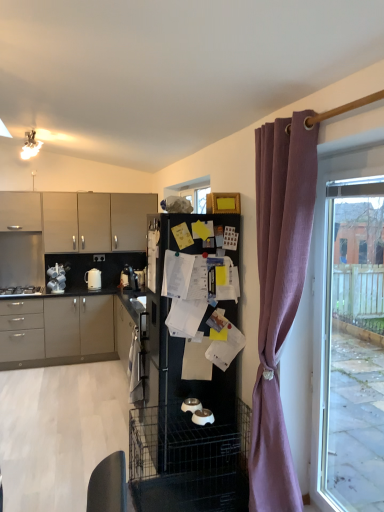
Question: Is white glossy kettle at left, positioned as the first appliance in top-to-bottom order, next to clear glass window at right and touching it?

Choices:
 (A) no
 (B) yes

Answer: (A)

Question: Can you confirm if white glossy kettle at left, arranged as the 2th appliance when viewed from the back, is thinner than clear glass window at right?

Choices:
 (A) no
 (B) yes

Answer: (A)

Question: Is white glossy kettle at left, positioned as the first appliance in top-to-bottom order, not close to clear glass window at right?

Choices:
 (A) no
 (B) yes

Answer: (B)

Question: Would you say clear glass window at right is part of white glossy kettle at left, the 3th appliance when ordered from front to back,'s contents?

Choices:
 (A) no
 (B) yes

Answer: (A)

Question: Is white glossy kettle at left, the 4th appliance when ordered from right to left, at the right side of clear glass window at right?

Choices:
 (A) yes
 (B) no

Answer: (B)

Question: From the image's perspective, is mauve fabric curtain at right located above or below white glossy kettle at left, acting as the first appliance starting from the left?

Choices:
 (A) above
 (B) below

Answer: (B)

Question: Considering the relative positions of mauve fabric curtain at right and white glossy kettle at left, the 4th appliance from the bottom, in the image provided, is mauve fabric curtain at right to the left or to the right of white glossy kettle at left, the 4th appliance from the bottom,?

Choices:
 (A) left
 (B) right

Answer: (B)

Question: In the image, is mauve fabric curtain at right positioned in front of or behind white glossy kettle at left, the 4th appliance when ordered from right to left?

Choices:
 (A) behind
 (B) front

Answer: (B)

Question: Is mauve fabric curtain at right wider or thinner than white glossy kettle at left, acting as the first appliance starting from the left?

Choices:
 (A) wide
 (B) thin

Answer: (A)

Question: Is point (193, 397) closer or farther from the camera than point (198, 417)?

Choices:
 (A) closer
 (B) farther

Answer: (B)

Question: Looking at their shapes, would you say white glossy bowls at center, the third appliance positioned from the left, is wider or thinner than white glossy pet bowls at center, the 4th appliance positioned from the back?

Choices:
 (A) wide
 (B) thin

Answer: (B)

Question: Looking at the image, does white glossy bowls at center, the 3th appliance positioned from the back, seem bigger or smaller compared to white glossy pet bowls at center, which is the first appliance in front-to-back order?

Choices:
 (A) small
 (B) big

Answer: (A)

Question: Visually, is white glossy bowls at center, the third appliance positioned from the left, positioned to the left or to the right of white glossy pet bowls at center, the fourth appliance when ordered from top to bottom?

Choices:
 (A) left
 (B) right

Answer: (A)

Question: In terms of height, does stainless steel gas stove at left look taller or shorter compared to white glossy pet bowls at center, which ranks as the 1th appliance in bottom-to-top order?

Choices:
 (A) short
 (B) tall

Answer: (A)

Question: Based on their sizes in the image, would you say stainless steel gas stove at left is bigger or smaller than white glossy pet bowls at center, the fourth appliance in the left-to-right sequence?

Choices:
 (A) small
 (B) big

Answer: (B)